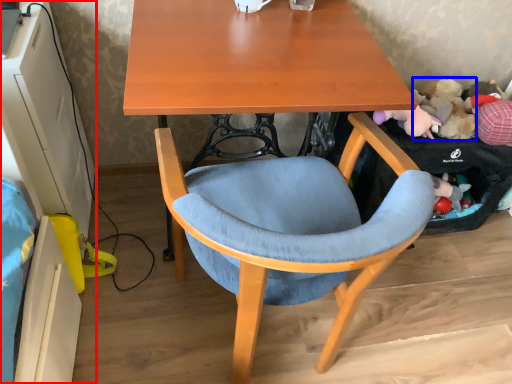
Question: Among these objects, which one is farthest to the camera, computer desk (highlighted by a red box) or toy (highlighted by a blue box)?

Choices:
 (A) computer desk
 (B) toy

Answer: (B)